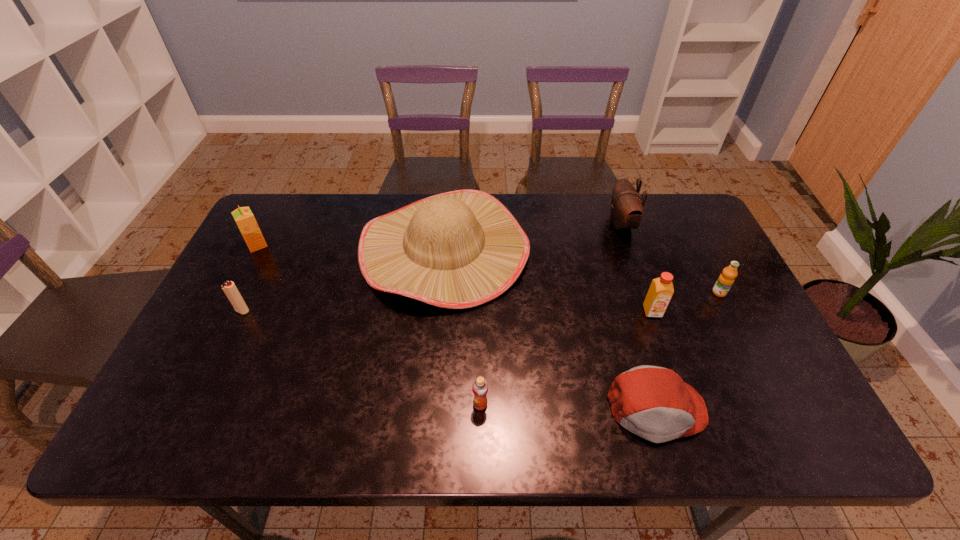
Locate an element on the screen. orange juice present at the far edge is located at coordinates (243, 216).

At what (x,y) coordinates should I click in order to perform the action: click on orange juice that is positioned at the near edge. Please return your answer as a coordinate pair (x, y). Looking at the image, I should click on (480, 386).

Identify the location of cap that is at the near edge. The image size is (960, 540). (652, 402).

Find the location of `orange juice present at the left edge`. orange juice present at the left edge is located at coordinates (243, 216).

You are a GUI agent. You are given a task and a screenshot of the screen. Output one action in this format:
    pyautogui.click(x=<x>, y=<y>)
    Task: Click on the igniter present at the left edge
    
    Given the screenshot: What is the action you would take?
    pyautogui.click(x=229, y=288)

You are a GUI agent. You are given a task and a screenshot of the screen. Output one action in this format:
    pyautogui.click(x=<x>, y=<y>)
    Task: Click on the object that is at the right edge
    
    Given the screenshot: What is the action you would take?
    pyautogui.click(x=726, y=279)

This screenshot has width=960, height=540. In order to click on object that is at the far left corner in this screenshot , I will do [x=243, y=216].

In the image, there is a desktop. Identify the location of free space at the far edge. Image resolution: width=960 pixels, height=540 pixels. (380, 195).

Identify the location of free region at the near edge of the desktop. This screenshot has height=540, width=960. (486, 418).

Locate an element on the screen. This screenshot has width=960, height=540. vacant position at the left edge of the desktop is located at coordinates (183, 372).